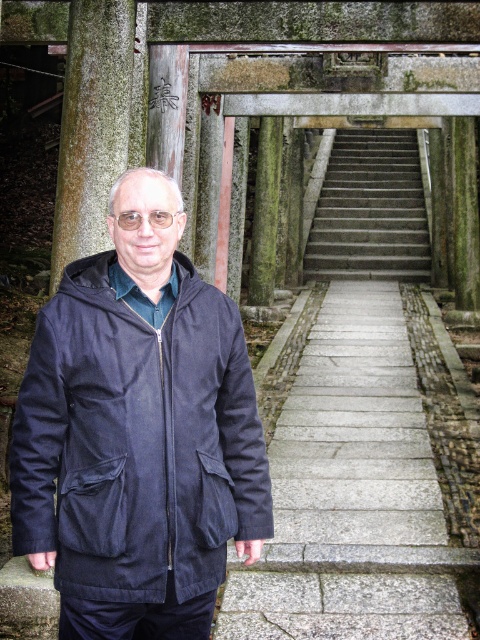
Can you confirm if gray concrete stairs at center is shorter than green mossy stone pillar at center?

In fact, gray concrete stairs at center may be taller than green mossy stone pillar at center.

Can you confirm if gray concrete stairs at center is positioned below green mossy stone pillar at center?

Actually, gray concrete stairs at center is above green mossy stone pillar at center.

Describe the element at coordinates (371, 211) in the screenshot. This screenshot has height=640, width=480. I see `gray concrete stairs at center` at that location.

Locate an element on the screen. gray concrete stairs at center is located at coordinates (371, 211).

Is navy blue fabric jacket at center to the left of gray concrete stairs at center from the viewer's perspective?

Yes, navy blue fabric jacket at center is to the left of gray concrete stairs at center.

Find the location of `navy blue fabric jacket at center`. navy blue fabric jacket at center is located at coordinates (136, 440).

Describe the element at coordinates (136, 440) in the screenshot. The height and width of the screenshot is (640, 480). I see `navy blue fabric jacket at center` at that location.

The image size is (480, 640). In order to click on navy blue fabric jacket at center in this screenshot , I will do `click(136, 440)`.

Can you confirm if navy blue fabric jacket at center is positioned to the right of green mossy stone pillar at center?

No, navy blue fabric jacket at center is not to the right of green mossy stone pillar at center.

Is point (78, 522) positioned in front of point (262, 301)?

Yes, it is in front of point (262, 301).

Where is `navy blue fabric jacket at center`? Image resolution: width=480 pixels, height=640 pixels. navy blue fabric jacket at center is located at coordinates (136, 440).